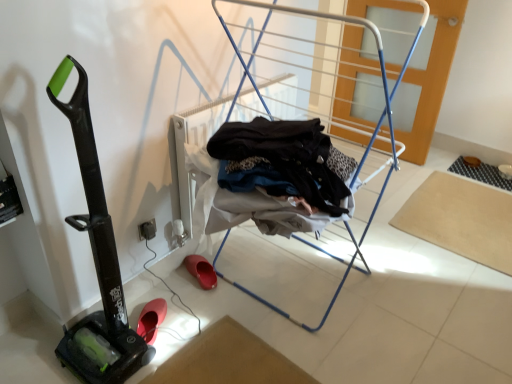
Question: Is rubber/matte clog at lower left, which is the 2th footwear from front to back, wider or thinner than metallic blue drying rack at center?

Choices:
 (A) thin
 (B) wide

Answer: (A)

Question: From the image's perspective, is rubber/matte clog at lower left, the 1th footwear when ordered from top to bottom, positioned above or below metallic blue drying rack at center?

Choices:
 (A) below
 (B) above

Answer: (A)

Question: Which of these objects is positioned closest to the rubber/matte clog at lower left, the 2th footwear viewed from the left?

Choices:
 (A) black rubber vacuum at left
 (B) beige fabric yoga mat at lower right
 (C) metallic blue drying rack at center
 (D) black plastic electric outlet at lower center
 (E) rubber/soft sole shoe at lower left, the second footwear when ordered from right to left

Answer: (E)

Question: Estimate the real-world distances between objects in this image. Which object is farther from the rubber/matte clog at lower left, which is the 2th footwear from front to back?

Choices:
 (A) metallic blue drying rack at center
 (B) black plastic electric outlet at lower center
 (C) beige fabric yoga mat at lower right
 (D) rubber/soft sole shoe at lower left, which is the first footwear from left to right
 (E) black rubber vacuum at left

Answer: (C)